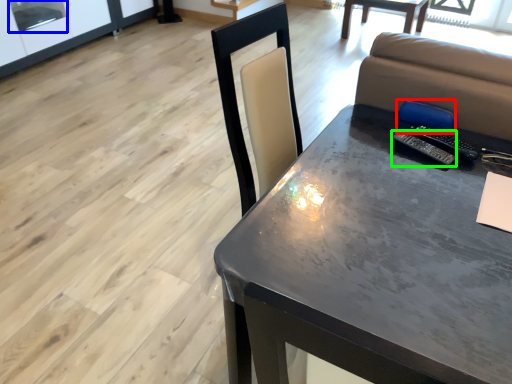
Question: Considering the real-world distances, which object is closest to armchair (highlighted by a red box)? window screen (highlighted by a blue box) or remote (highlighted by a green box).

Choices:
 (A) window screen
 (B) remote

Answer: (B)